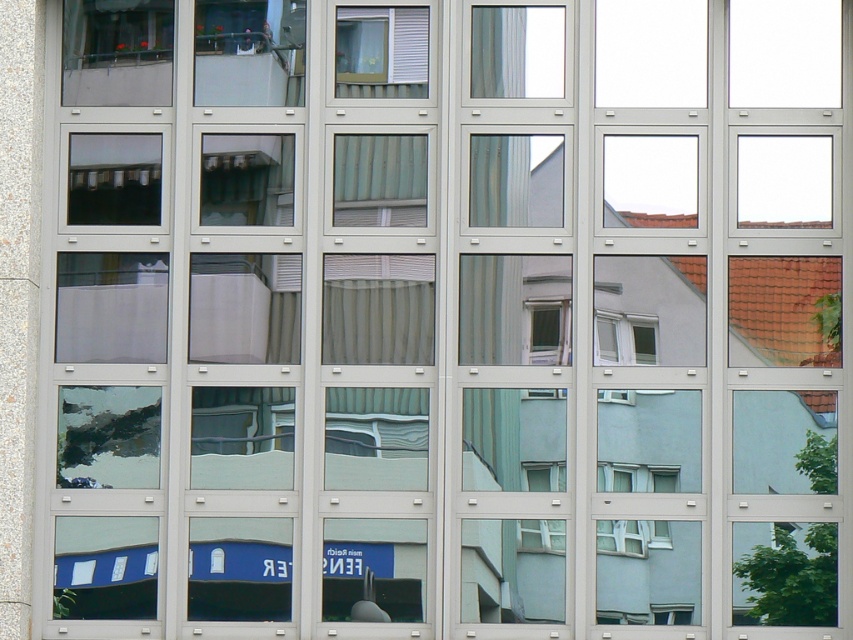
You are an architect analyzing the building facade shown in the image. You notice a point marked at coordinates (381, 45). Based on the scene description, what feature does this point correspond to?

The point at coordinates (381, 45) corresponds to white matte blinds at upper center.